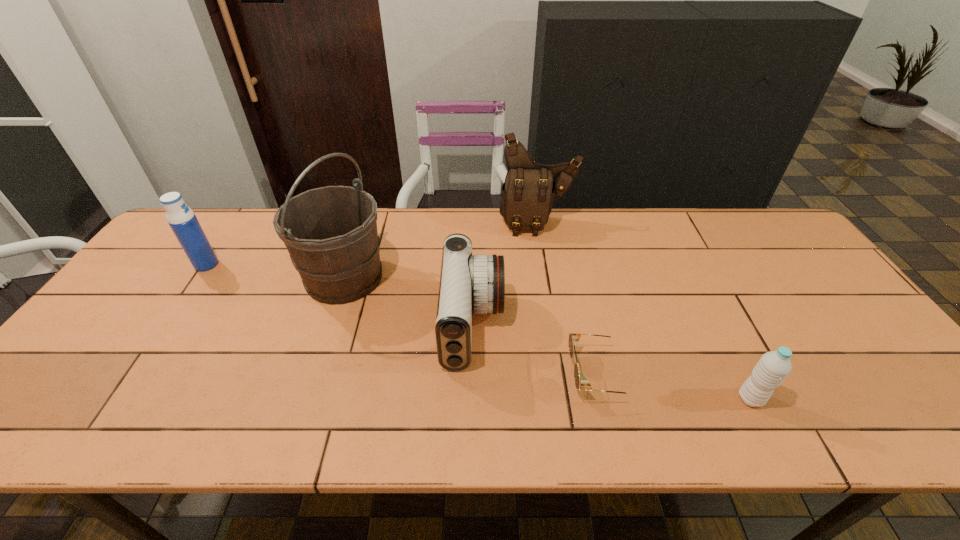
Where is `water bottle that is at the near edge`? The image size is (960, 540). water bottle that is at the near edge is located at coordinates (773, 367).

Image resolution: width=960 pixels, height=540 pixels. I want to click on sunglasses present at the near edge, so click(573, 337).

The height and width of the screenshot is (540, 960). I want to click on object at the left edge, so click(x=182, y=220).

Identify the location of blank area at the far edge. The width and height of the screenshot is (960, 540). (544, 248).

In the image, there is a desktop. Where is `vacant space at the near edge`? The width and height of the screenshot is (960, 540). vacant space at the near edge is located at coordinates (618, 406).

I want to click on vacant space at the left edge of the desktop, so click(63, 399).

The height and width of the screenshot is (540, 960). Identify the location of free space at the right edge of the desktop. (876, 360).

Locate an element on the screen. The width and height of the screenshot is (960, 540). free space between the rightmost object and the fifth object from right to left is located at coordinates (547, 338).

Identify the location of free space between the shortest object and the left water bottle. (403, 319).

Locate an element on the screen. The height and width of the screenshot is (540, 960). free spot between the tallest object and the rightmost object is located at coordinates (547, 338).